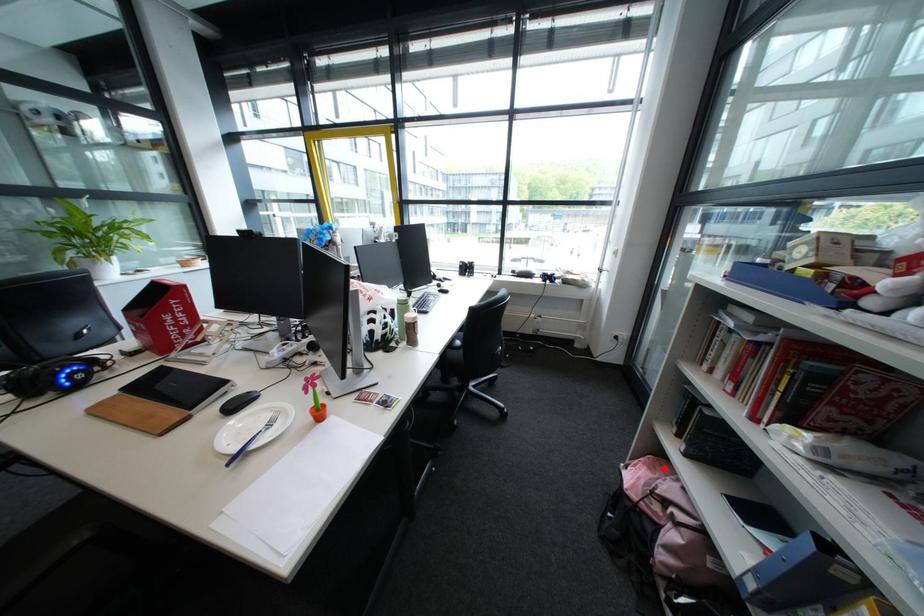
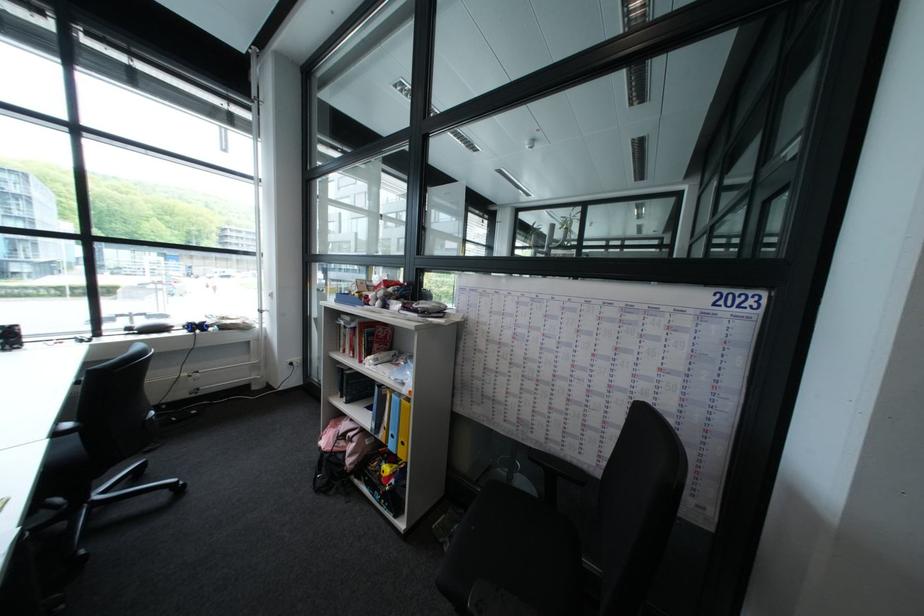
Question: I am providing you with two images of the same scene from different viewpoints. In image1, a red point is highlighted. Considering the same 3D point in image2, which of the following is correct?

Choices:
 (A) It is closer
 (B) It is farther

Answer: (B)